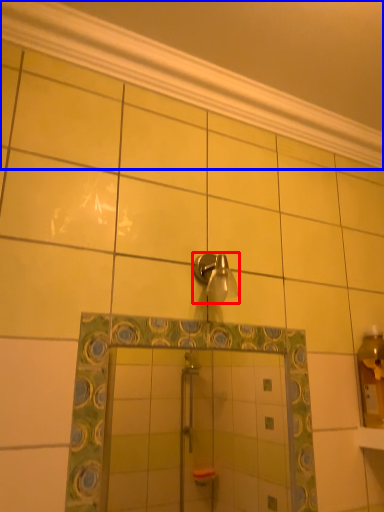
Question: Among these objects, which one is farthest to the camera, shower (highlighted by a red box) or molding (highlighted by a blue box)?

Choices:
 (A) shower
 (B) molding

Answer: (A)